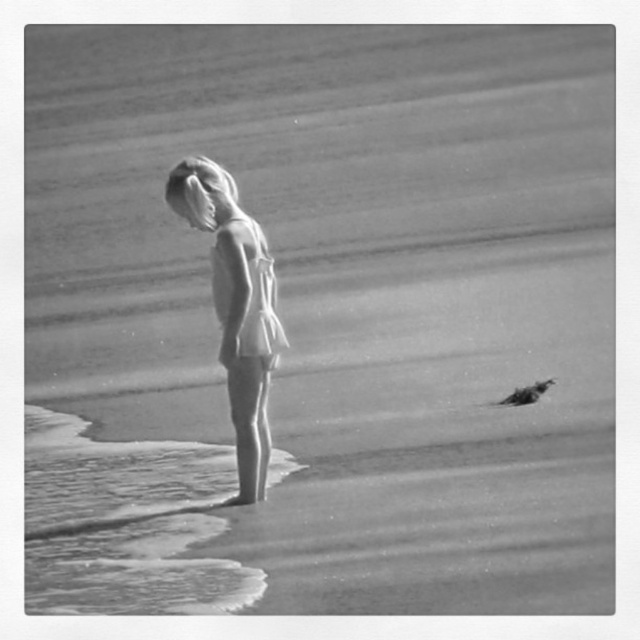
Who is higher up, clear water at lower left or smooth white dress at center?

smooth white dress at center

Between point (134, 541) and point (241, 298), which one is positioned behind?

The point (134, 541) is behind.

Find the location of a particular element. clear water at lower left is located at coordinates (124, 524).

Which is below, smooth white dress at center or smooth feathered bird at lower right?

smooth feathered bird at lower right

Is point (282, 342) behind point (513, 404)?

No, (282, 342) is in front of (513, 404).

Is point (182, 188) positioned behind point (531, 401)?

No, it is not.

Locate an element on the screen. This screenshot has height=640, width=640. smooth white dress at center is located at coordinates (236, 307).

Can you confirm if clear water at lower left is positioned to the right of smooth feathered bird at lower right?

In fact, clear water at lower left is to the left of smooth feathered bird at lower right.

The height and width of the screenshot is (640, 640). What are the coordinates of `clear water at lower left` in the screenshot? It's located at (124, 524).

Find the location of a particular element. The image size is (640, 640). clear water at lower left is located at coordinates (124, 524).